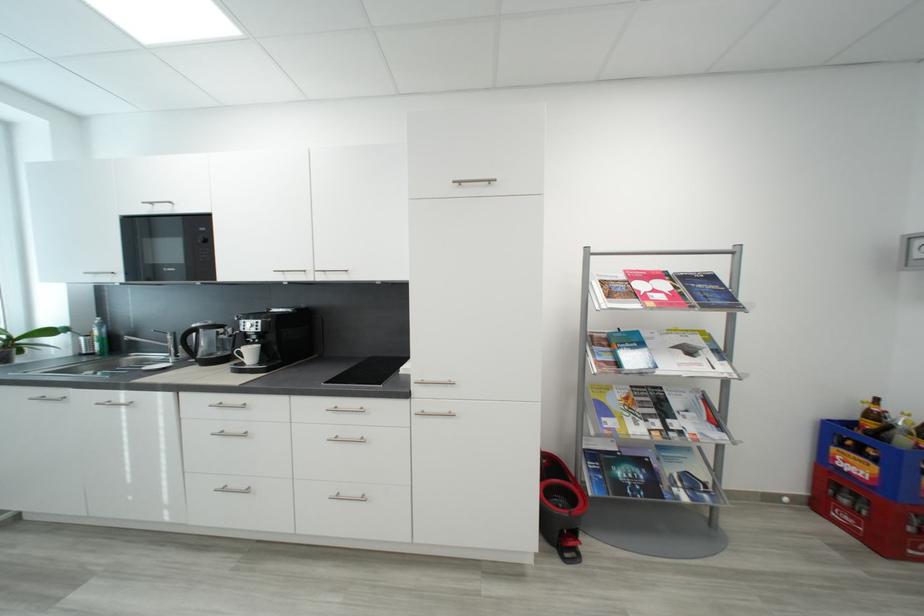
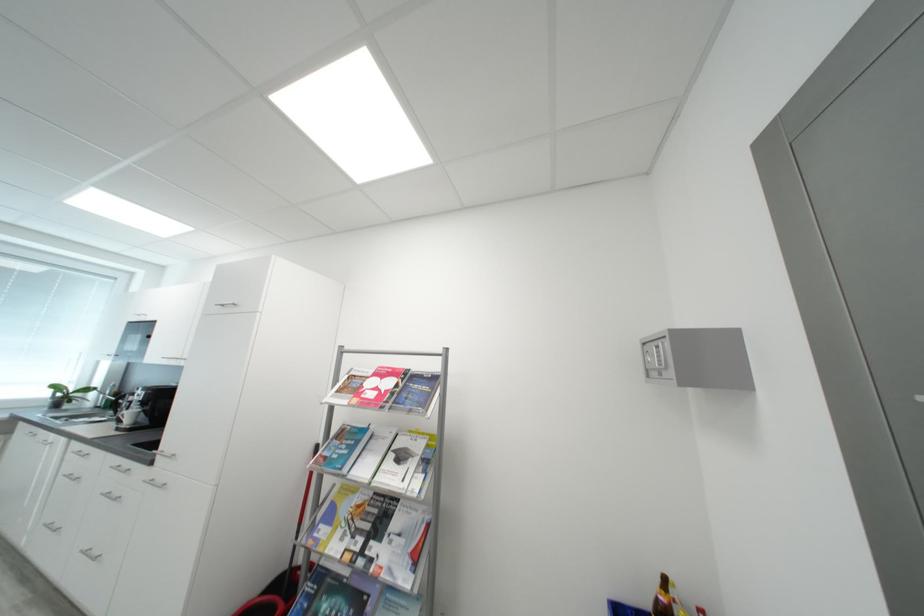
Locate, in the second image, the point that corresponds to the point at 257,354 in the first image.

(138, 416)